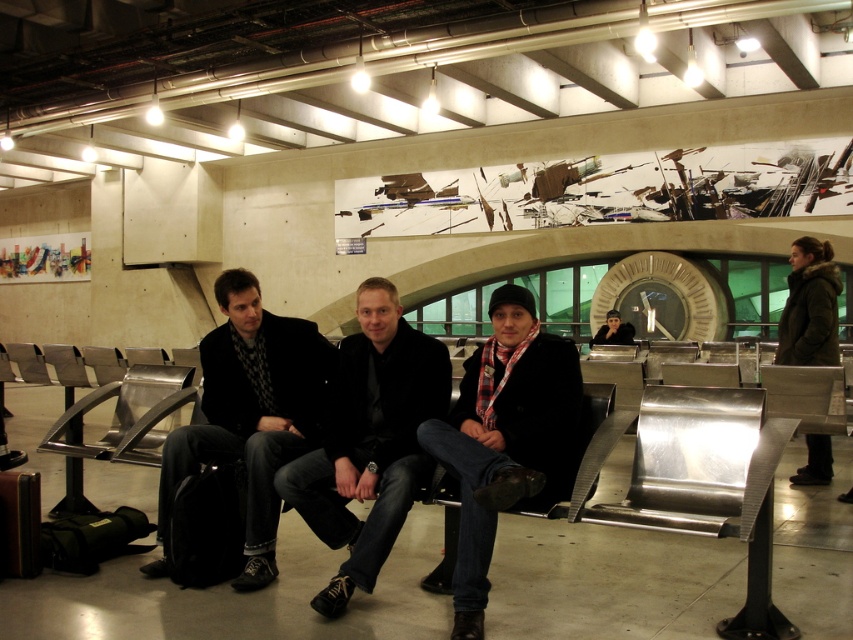
Is point (384, 328) less distant than point (457, 442)?

No, (384, 328) is behind (457, 442).

Does point (358, 529) come in front of point (437, 429)?

No, (358, 529) is behind (437, 429).

Find the location of `black matte jacket at center`. black matte jacket at center is located at coordinates (369, 440).

Between point (401, 355) and point (607, 314), which one is positioned in front?

Point (401, 355)

This screenshot has height=640, width=853. Identify the location of black matte jacket at center. (369, 440).

This screenshot has height=640, width=853. What do you see at coordinates (369, 440) in the screenshot? I see `black matte jacket at center` at bounding box center [369, 440].

In order to click on black matte jacket at center in this screenshot , I will do `click(369, 440)`.

Is black matte jacket at center taller than matte black jacket at center?

In fact, black matte jacket at center may be shorter than matte black jacket at center.

Is black matte jacket at center in front of matte black jacket at center?

Yes, black matte jacket at center is closer to the viewer.

Between point (370, 355) and point (291, 394), which one is positioned in front?

Point (370, 355)

The width and height of the screenshot is (853, 640). I want to click on black matte jacket at center, so click(x=369, y=440).